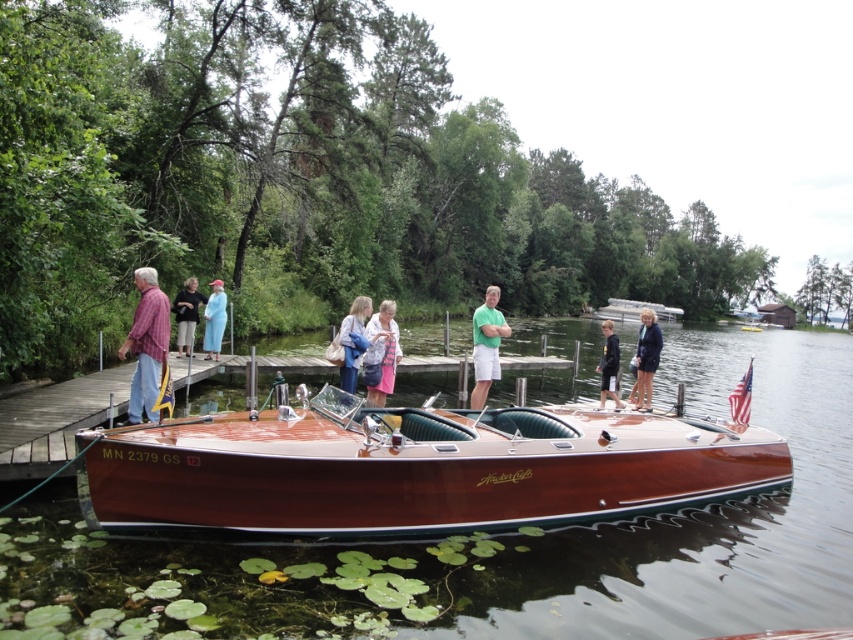
You are a photographer standing at the lakeside and want to capture a photo of the wooden boat at center without the light blue denim jacket at center appearing in the frame. Is this possible based on their positions?

The wooden boat at center is in front of the light blue denim jacket at center, so the boat will block the jacket from view. Therefore, you can take a photo of the wooden boat at center without the light blue denim jacket at center showing in the frame.

You are a photographer wanting to capture both the matte red shirt at left and the dark blue fabric coat at center in a single frame. Since you want to ensure both are visible, which clothing item should you focus on first to avoid blurring due to their sizes?

The matte red shirt at left is smaller in width than the dark blue fabric coat at center. Therefore, you should focus on the dark blue fabric coat at center first as it is larger and might require more attention to capture details without blurring.

You are a photographer at the lakeside and want to capture a photo of the matte red shirt at left and dark blue fabric coat at center. Which clothing item appears taller in the photo?

The matte red shirt at left appears taller than the dark blue fabric coat at center in the photo.